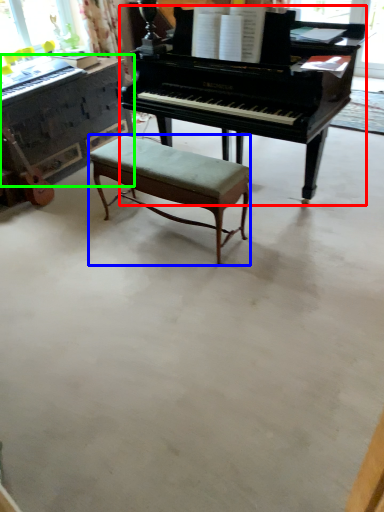
Question: Which is nearer to the piano (highlighted by a red box)? stool (highlighted by a blue box) or piano (highlighted by a green box).

Choices:
 (A) stool
 (B) piano

Answer: (A)